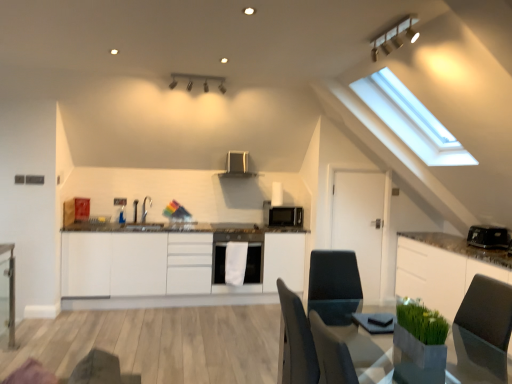
Question: In terms of height, does smooth gray table at lower right, the second table viewed from the left, look taller or shorter compared to black matte microwave at center?

Choices:
 (A) tall
 (B) short

Answer: (A)

Question: Looking at their shapes, would you say smooth gray table at lower right, which is the 1th table from right to left, is wider or thinner than black matte microwave at center?

Choices:
 (A) thin
 (B) wide

Answer: (B)

Question: Which is farther from the white matte door at center?

Choices:
 (A) white matte dishwasher at center
 (B) white glossy cabinet at right, which is the 1th cabinetry from right to left
 (C) white matte cabinetry at center, which is counted as the first cabinetry, starting from the left
 (D) clear glass table at left, marked as the 2th table in a front-to-back arrangement
 (E) black plastic toaster at right

Answer: (D)

Question: Which object is positioned farthest from the matte black exhaust hood at upper center?

Choices:
 (A) smooth gray table at lower right, acting as the 1th table starting from the front
 (B) white matte door at center
 (C) black plastic toaster at right
 (D) matte silver light fixture at upper center, which is the 2th light fixture from back to front
 (E) white matte cabinetry at center, which is counted as the first cabinetry, starting from the left

Answer: (A)